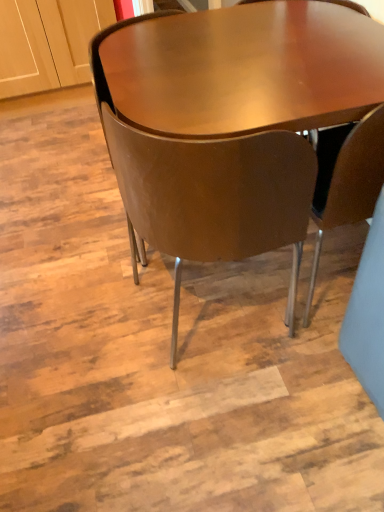
Question: Does matte brown chair at center, which ranks as the first chair in right-to-left order, have a greater width compared to brown leather chair at center, the 2th chair viewed from the right?

Choices:
 (A) yes
 (B) no

Answer: (B)

Question: Does matte brown chair at center, which ranks as the first chair in right-to-left order, lie in front of brown leather chair at center, which is counted as the second chair, starting from the left?

Choices:
 (A) no
 (B) yes

Answer: (A)

Question: Is matte brown chair at center, which ranks as the first chair in right-to-left order, in contact with brown leather chair at center, the 2th chair viewed from the right?

Choices:
 (A) yes
 (B) no

Answer: (B)

Question: From a real-world perspective, is matte brown chair at center, which ranks as the 3th chair in left-to-right order, positioned under brown leather chair at center, the 2th chair viewed from the right, based on gravity?

Choices:
 (A) no
 (B) yes

Answer: (B)

Question: From the image's perspective, is matte brown chair at center, which ranks as the first chair in right-to-left order, located beneath brown leather chair at center, which is counted as the second chair, starting from the left?

Choices:
 (A) no
 (B) yes

Answer: (A)

Question: Can you confirm if matte brown chair at center, which ranks as the 3th chair in left-to-right order, is bigger than brown leather chair at center, the 2th chair viewed from the right?

Choices:
 (A) yes
 (B) no

Answer: (B)

Question: Is matte brown chair at center, which ranks as the first chair in right-to-left order, at the back of brown leather chair at center, the 2th chair viewed from the right?

Choices:
 (A) yes
 (B) no

Answer: (B)

Question: Is brown leather chair at center, which is counted as the second chair, starting from the left, wider than matte brown chair at center, which ranks as the 3th chair in left-to-right order?

Choices:
 (A) no
 (B) yes

Answer: (B)

Question: From a real-world perspective, is brown leather chair at center, which is counted as the second chair, starting from the left, under matte brown chair at center, which ranks as the first chair in right-to-left order?

Choices:
 (A) no
 (B) yes

Answer: (A)

Question: From a real-world perspective, is brown leather chair at center, which is counted as the second chair, starting from the left, over matte brown chair at center, which ranks as the first chair in right-to-left order?

Choices:
 (A) no
 (B) yes

Answer: (B)

Question: From the image's perspective, is brown leather chair at center, the 2th chair viewed from the right, located above matte brown chair at center, which ranks as the 3th chair in left-to-right order?

Choices:
 (A) no
 (B) yes

Answer: (A)

Question: Is brown leather chair at center, the 2th chair viewed from the right, closer to camera compared to matte brown chair at center, which ranks as the first chair in right-to-left order?

Choices:
 (A) no
 (B) yes

Answer: (B)

Question: Is brown leather chair at center, the 2th chair viewed from the right, far away from brown leather chair at center, which ranks as the 3th chair in right-to-left order?

Choices:
 (A) no
 (B) yes

Answer: (A)